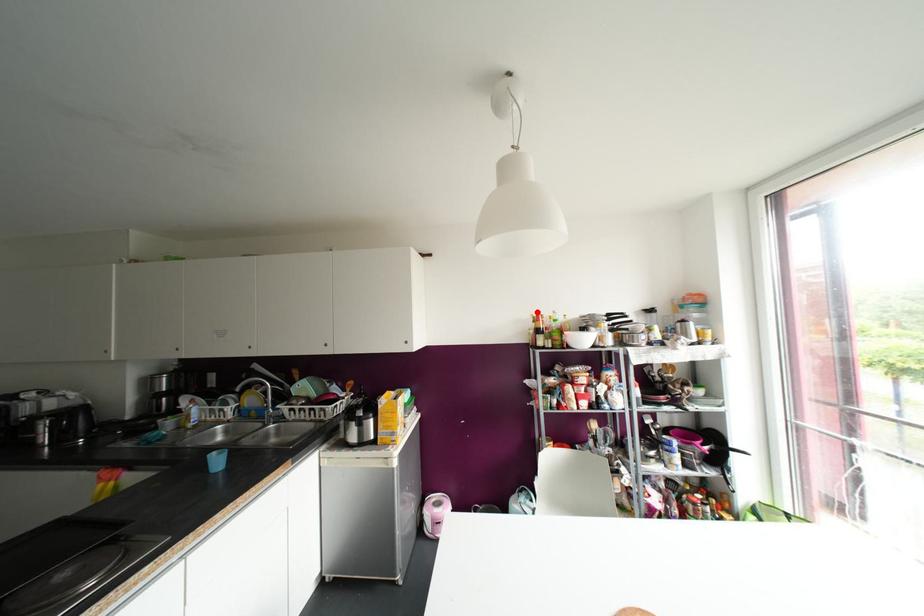
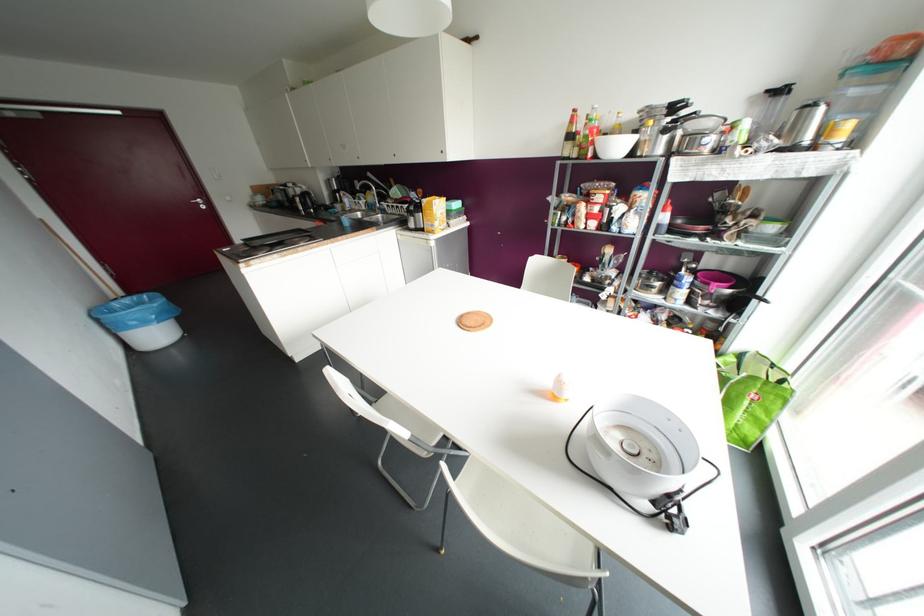
Find the pixel in the second image that matches the highlighted location in the first image.

(574, 110)